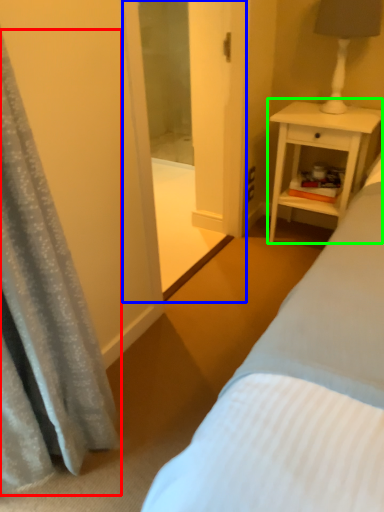
Question: Estimate the real-world distances between objects in this image. Which object is farther from curtain (highlighted by a red box), screen door (highlighted by a blue box) or nightstand (highlighted by a green box)?

Choices:
 (A) screen door
 (B) nightstand

Answer: (B)